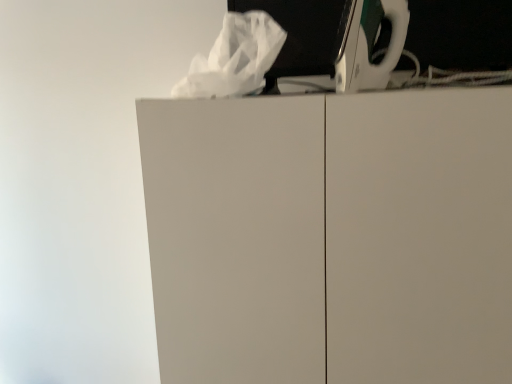
What do you see at coordinates (331, 237) in the screenshot?
I see `white matte cabinet at center` at bounding box center [331, 237].

What is the approximate height of white matte cabinet at center?

white matte cabinet at center is 1.07 meters tall.

Locate an element on the screen. The height and width of the screenshot is (384, 512). white matte cabinet at center is located at coordinates (331, 237).

Find the location of a particular element. Image resolution: width=512 pixels, height=384 pixels. white matte cabinet at center is located at coordinates (331, 237).